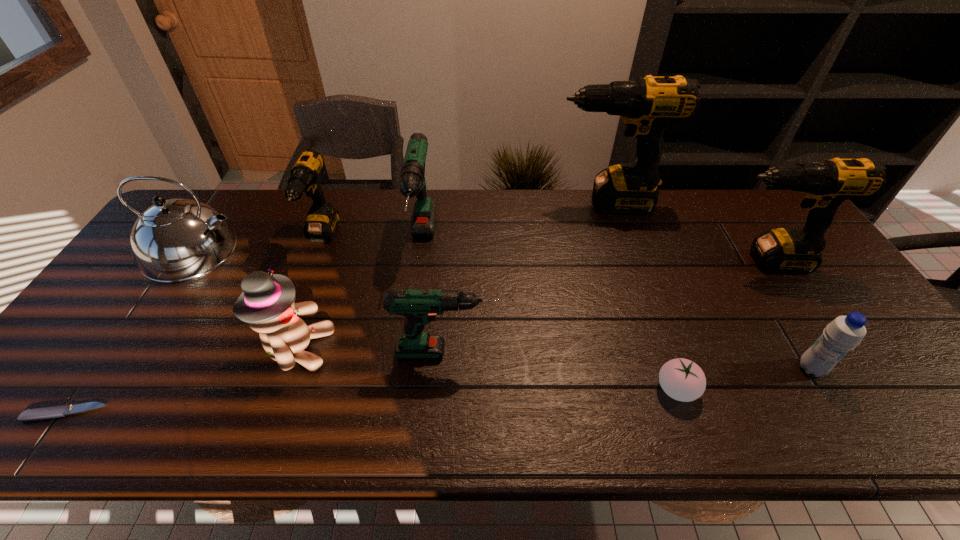
The height and width of the screenshot is (540, 960). In order to click on the second black drill from left to right in this screenshot , I will do `click(648, 105)`.

This screenshot has width=960, height=540. In order to click on the tallest drill in this screenshot , I will do `click(648, 105)`.

At what (x,y) coordinates should I click in order to perform the action: click on the second smallest black drill. Please return your answer as a coordinate pair (x, y). The width and height of the screenshot is (960, 540). Looking at the image, I should click on (825, 184).

In order to click on the rightmost black drill in this screenshot , I will do `click(825, 184)`.

The width and height of the screenshot is (960, 540). Find the location of `the bigger green drill`. the bigger green drill is located at coordinates (412, 180).

Image resolution: width=960 pixels, height=540 pixels. Find the location of `kettle`. kettle is located at coordinates (175, 240).

You are a GUI agent. You are given a task and a screenshot of the screen. Output one action in this format:
    pyautogui.click(x=<x>, y=<y>)
    Task: Click on the smallest black drill
    The width and height of the screenshot is (960, 540).
    Given the screenshot: What is the action you would take?
    pyautogui.click(x=322, y=220)

At what (x,y) coordinates should I click in order to perform the action: click on the leftmost black drill. Please return your answer as a coordinate pair (x, y). Image resolution: width=960 pixels, height=540 pixels. Looking at the image, I should click on (322, 220).

The width and height of the screenshot is (960, 540). I want to click on rag_doll, so click(267, 304).

The height and width of the screenshot is (540, 960). Find the location of `the shortest drill`. the shortest drill is located at coordinates (420, 307).